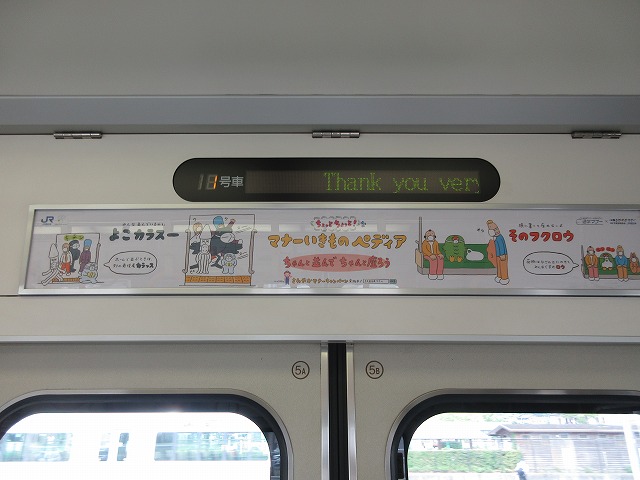
Find the location of a particular element. left door is located at coordinates (161, 375).